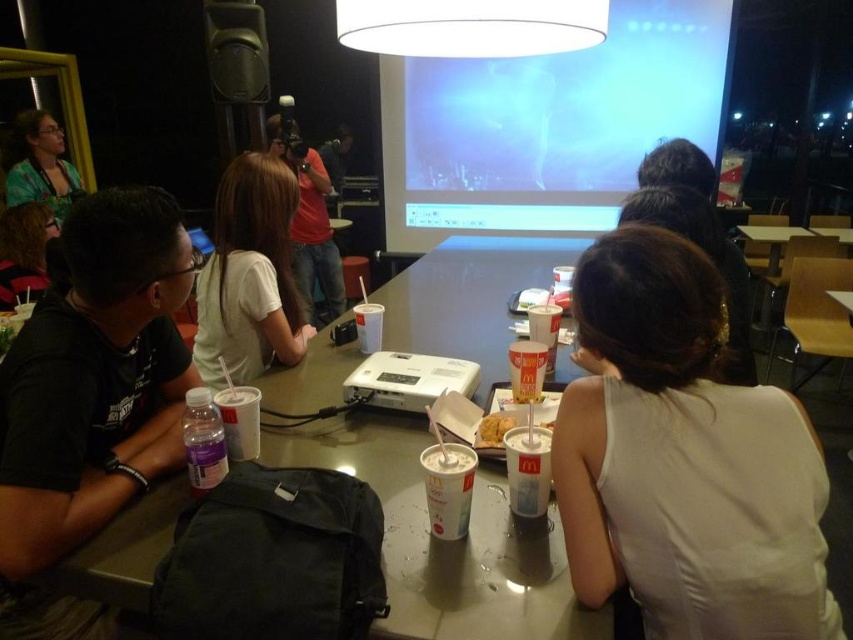
You are a photographer trying to capture both the white fabric shirt at center and the white plastic projector at center in a single shot. Based on their positions, which object should you adjust your camera to focus on first if you want to include both in your frame?

The white fabric shirt at center is to the right of the white plastic projector at center, so you should focus on the white plastic projector at center first to ensure both are in frame.

Consider the image. You are taking a photo of the scene and want to focus on both the point at coordinates point (769, 461) and the point at coordinates point (370, 388). Since the camera can only focus on one point at a time, which point should you choose to ensure the other is still in focus?

You should focus on point (370, 388) because it is farther from the camera than point (769, 461). This way, the point closer to the camera will naturally be in focus as well.